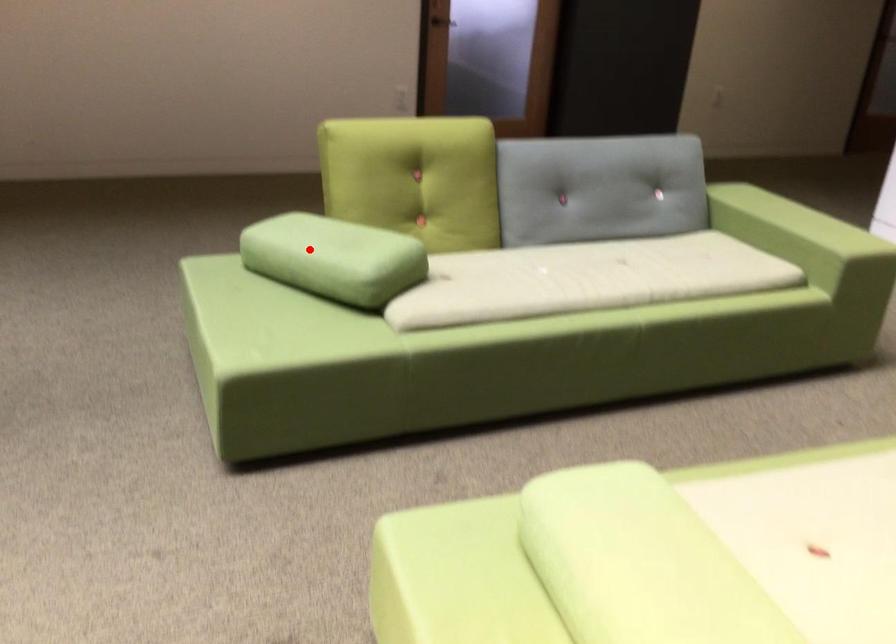
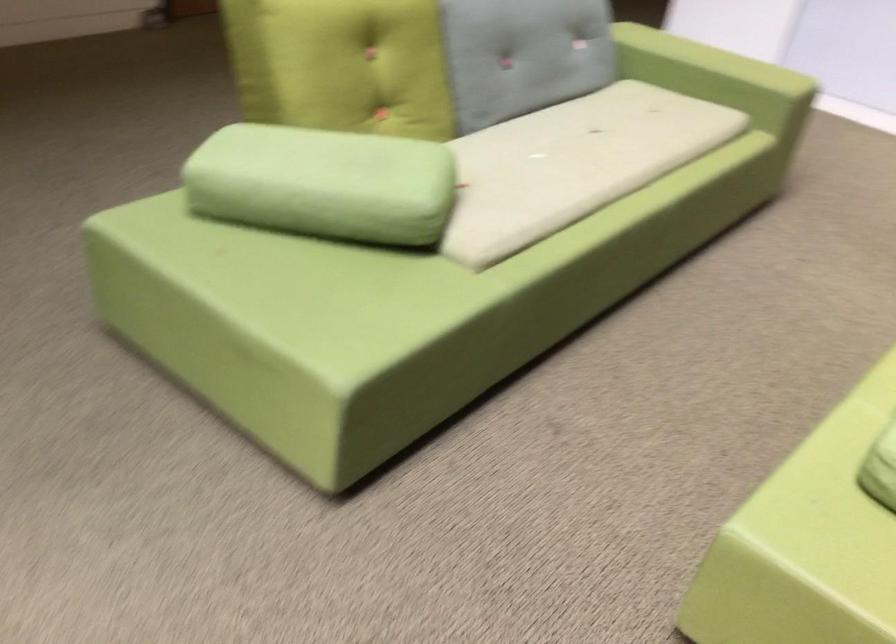
Question: I am providing you with two images of the same scene from different viewpoints. Given a red point in image1, look at the same physical point in image2. Is it:

Choices:
 (A) Closer to the viewpoint
 (B) Farther from the viewpoint

Answer: (A)